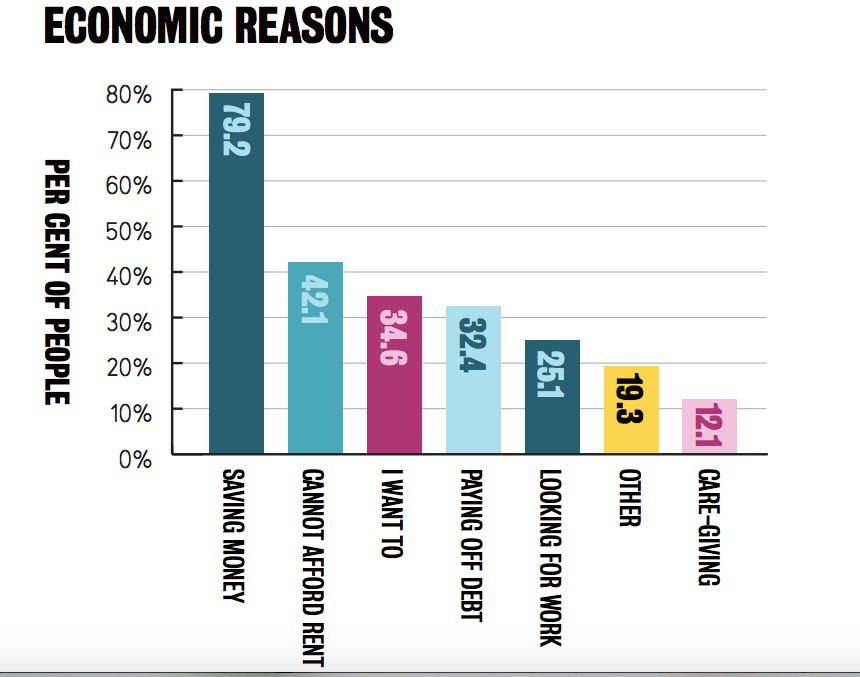
The image size is (860, 677). Find the location of `bar`. bar is located at coordinates (478, 434).